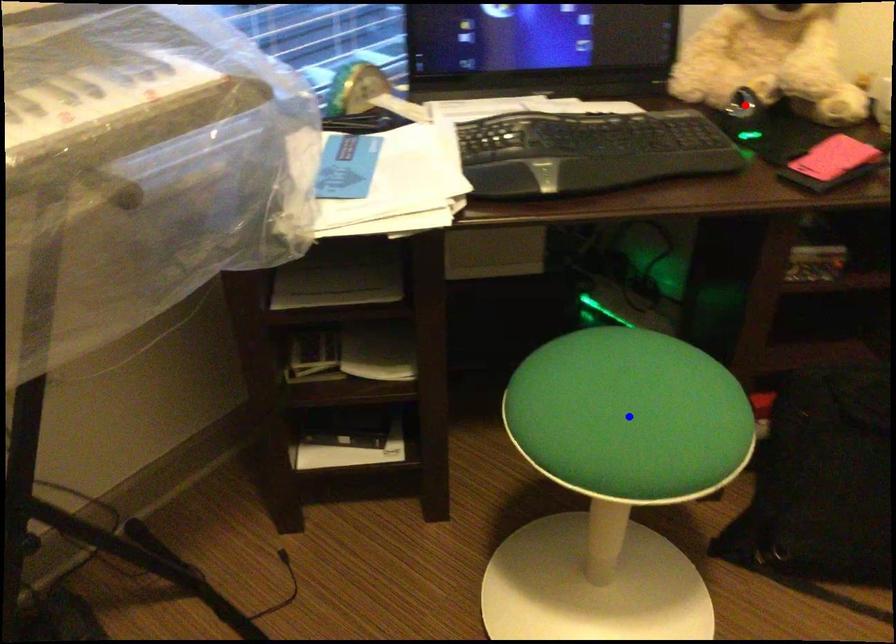
Question: Two points are marked on the image. Which point is closer to the camera?

Choices:
 (A) Blue point is closer.
 (B) Red point is closer.

Answer: (A)